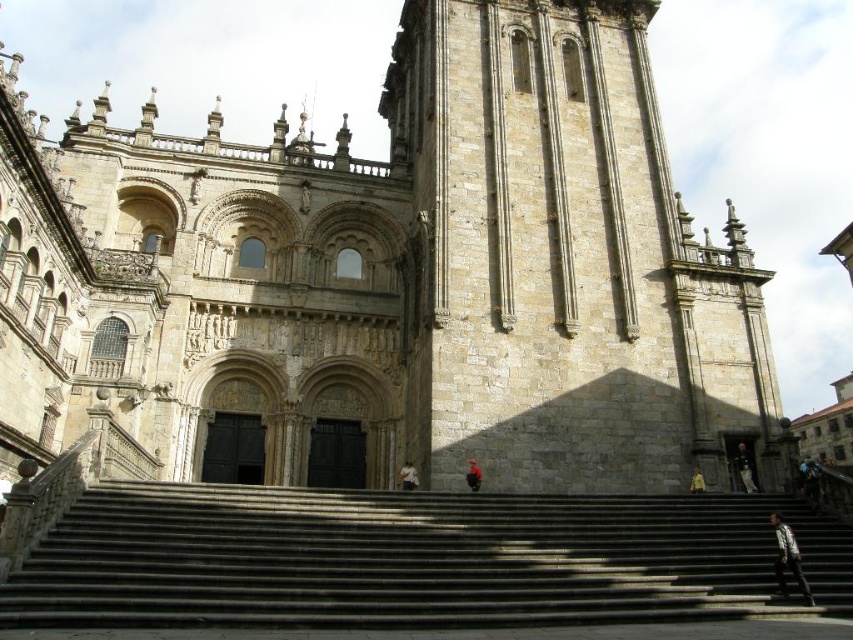
Question: Among these points, which one is nearest to the camera?

Choices:
 (A) (804, 484)
 (B) (737, 460)
 (C) (796, 557)

Answer: (C)

Question: Is white fabric at center thinner than light brown leather jacket at right?

Choices:
 (A) no
 (B) yes

Answer: (B)

Question: Which of the following is the farthest from the observer?

Choices:
 (A) (473, 464)
 (B) (804, 595)

Answer: (A)

Question: Which object is the farthest from the light brown leather jacket at right?

Choices:
 (A) dark blue jeans at lower right
 (B) dark gray fabric jacket at lower right
 (C) gray stone stairs at center

Answer: (C)

Question: Is dark blue jeans at lower right behind light brown leather jacket at right?

Choices:
 (A) yes
 (B) no

Answer: (A)

Question: Is gray stone stairs at center below red fabric person at center?

Choices:
 (A) no
 (B) yes

Answer: (B)